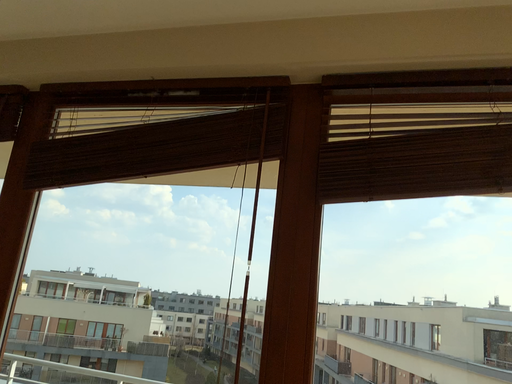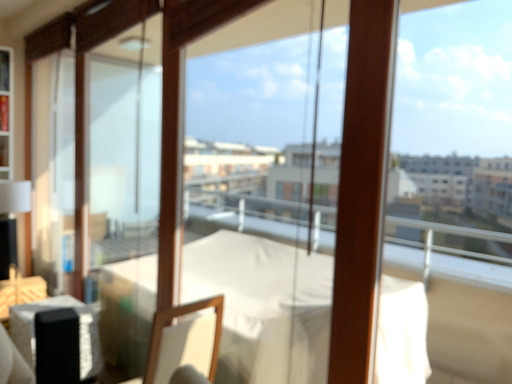
Question: How did the camera likely rotate when shooting the video?

Choices:
 (A) rotated left
 (B) rotated right

Answer: (A)